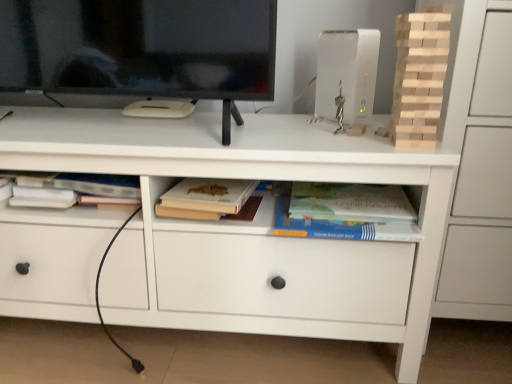
Question: Considering the relative sizes of white plastic router at upper right and hardcover book at center, arranged as the 1th paperback book when viewed from the right, in the image provided, is white plastic router at upper right bigger than hardcover book at center, arranged as the 1th paperback book when viewed from the right,?

Choices:
 (A) yes
 (B) no

Answer: (A)

Question: Can you confirm if white plastic router at upper right is positioned to the right of hardcover book at center, acting as the second paperback book starting from the left?

Choices:
 (A) yes
 (B) no

Answer: (A)

Question: Considering the relative sizes of white plastic router at upper right and hardcover book at center, acting as the second paperback book starting from the left, in the image provided, is white plastic router at upper right taller than hardcover book at center, acting as the second paperback book starting from the left,?

Choices:
 (A) no
 (B) yes

Answer: (B)

Question: Is white plastic router at upper right shorter than hardcover book at center, acting as the second paperback book starting from the left?

Choices:
 (A) no
 (B) yes

Answer: (A)

Question: From a real-world perspective, does white plastic router at upper right stand above hardcover book at center, arranged as the 1th paperback book when viewed from the right?

Choices:
 (A) yes
 (B) no

Answer: (A)

Question: Considering the positions of point (160, 203) and point (443, 43), is point (160, 203) closer or farther from the camera than point (443, 43)?

Choices:
 (A) farther
 (B) closer

Answer: (A)

Question: Is matte beige book at center, marked as the 2th paperback book in a right-to-left arrangement, in front of or behind natural wood tower at upper right in the image?

Choices:
 (A) front
 (B) behind

Answer: (B)

Question: In the image, is matte beige book at center, marked as the 2th paperback book in a right-to-left arrangement, on the left side or the right side of natural wood tower at upper right?

Choices:
 (A) right
 (B) left

Answer: (B)

Question: From a real-world perspective, relative to natural wood tower at upper right, is matte beige book at center, which ranks as the first paperback book in left-to-right order, vertically above or below?

Choices:
 (A) below
 (B) above

Answer: (A)

Question: Is hardcover book at center, arranged as the 1th paperback book when viewed from the right, to the left or to the right of white matte chest of drawers at center in the image?

Choices:
 (A) right
 (B) left

Answer: (A)

Question: In the image, is hardcover book at center, acting as the second paperback book starting from the left, positioned in front of or behind white matte chest of drawers at center?

Choices:
 (A) behind
 (B) front

Answer: (A)

Question: Is hardcover book at center, acting as the second paperback book starting from the left, situated inside white matte chest of drawers at center or outside?

Choices:
 (A) outside
 (B) inside

Answer: (B)

Question: Looking at the image, does hardcover book at center, arranged as the 1th paperback book when viewed from the right, seem bigger or smaller compared to white matte chest of drawers at center?

Choices:
 (A) small
 (B) big

Answer: (A)

Question: Does point (346, 221) appear closer or farther from the camera than point (426, 44)?

Choices:
 (A) closer
 (B) farther

Answer: (B)

Question: Looking at their shapes, would you say hardcover book at center, arranged as the 1th paperback book when viewed from the right, is wider or thinner than natural wood tower at upper right?

Choices:
 (A) thin
 (B) wide

Answer: (B)